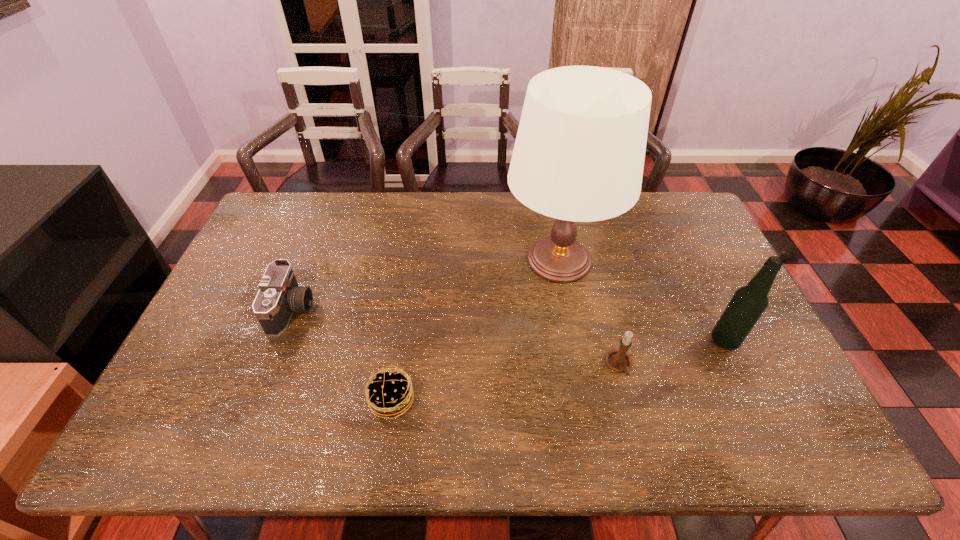
Locate an element on the screen. This screenshot has width=960, height=540. object that is the third closest to the tallest object is located at coordinates tap(388, 393).

You are a GUI agent. You are given a task and a screenshot of the screen. Output one action in this format:
    pyautogui.click(x=<x>, y=<y>)
    Task: Click on the object that stands as the second closest to the rightmost object
    
    Given the screenshot: What is the action you would take?
    pyautogui.click(x=618, y=360)

Where is `vacant point that satisfies the following two spatial constraints: 1. on the front-facing side of the alcohol; 2. on the right side of the leftmost object`? The height and width of the screenshot is (540, 960). vacant point that satisfies the following two spatial constraints: 1. on the front-facing side of the alcohol; 2. on the right side of the leftmost object is located at coordinates (280, 341).